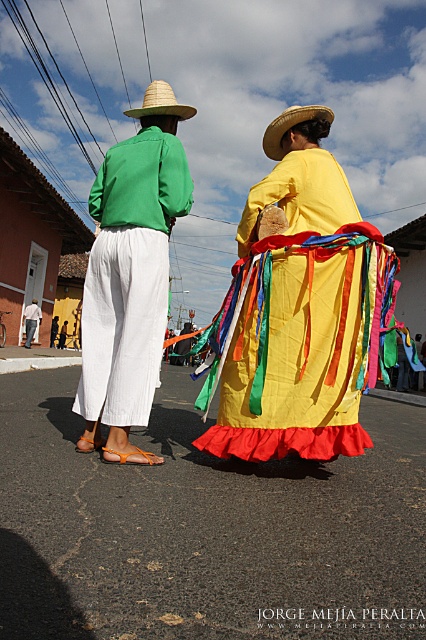
You are standing at the camera position observing the two people in the image. Which of the two points, point (x=149, y=99) or point (x=23, y=310), is closer to you?

Point (x=149, y=99) is closer to the viewer than point (x=23, y=310).

You are standing behind two people walking away from you. The person wearing the green cotton shirt at left is walking next to the person in the matte green shirt at center. Which one is positioned more to your right side?

The green cotton shirt at left is positioned more to the right side than the matte green shirt at center.